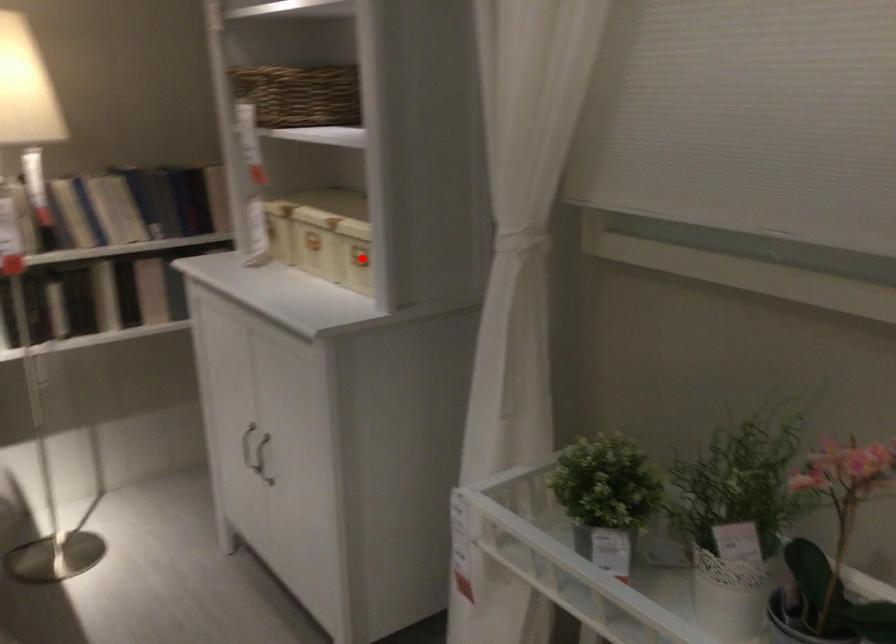
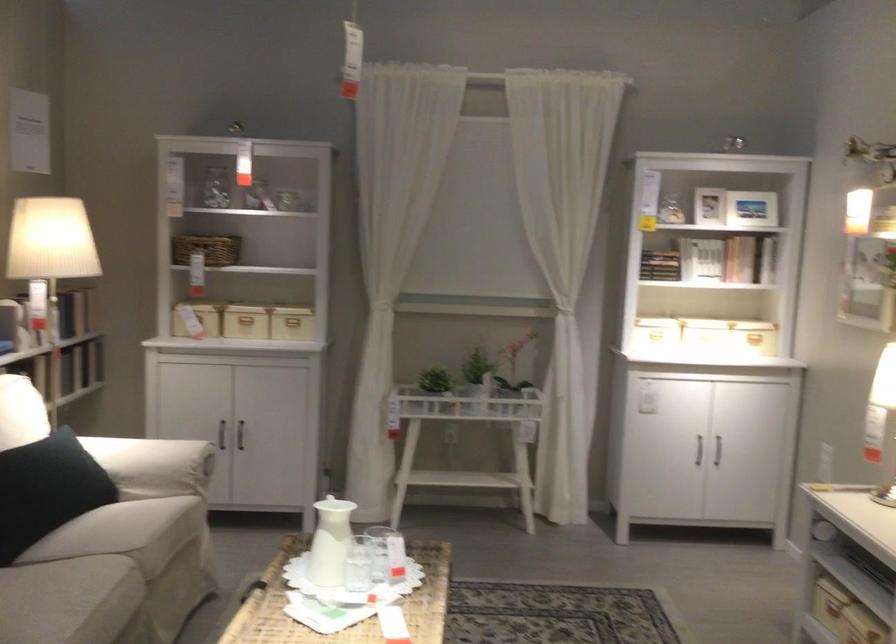
Question: I am providing you with two images of the same scene from different viewpoints. Given a red point in image1, look at the same physical point in image2. Is it:

Choices:
 (A) Closer to the viewpoint
 (B) Farther from the viewpoint

Answer: (B)